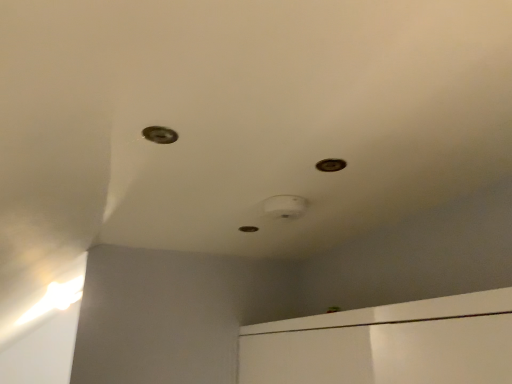
Find the location of a particular element. metallic hole at center, which appears as the third hole when viewed from the top is located at coordinates (248, 229).

Measure the distance between point [248,231] and camera.

The distance of point [248,231] from camera is 1.75 meters.

The image size is (512, 384). What do you see at coordinates (331, 165) in the screenshot?
I see `metallic circular hole at upper center, which appears as the 2th hole when viewed from the top` at bounding box center [331, 165].

I want to click on metallic hole at center, which appears as the second hole when viewed from the left, so click(248, 229).

From the image's perspective, is metallic circular hole at upper center, the second hole in the front-to-back sequence, below metallic circular hole at upper left, the 3th hole in the back-to-front sequence?

Yes, from the image's perspective, metallic circular hole at upper center, the second hole in the front-to-back sequence, is beneath metallic circular hole at upper left, the 3th hole in the back-to-front sequence.

Is metallic circular hole at upper center, the second hole in the front-to-back sequence, situated inside metallic circular hole at upper left, placed as the 1th hole when sorted from left to right, or outside?

metallic circular hole at upper center, the second hole in the front-to-back sequence, is located beyond the bounds of metallic circular hole at upper left, placed as the 1th hole when sorted from left to right.

Locate an element on the screen. The image size is (512, 384). hole that is the 1st object located behind the metallic circular hole at upper left, which ranks as the 1th hole in front-to-back order is located at coordinates (331, 165).

Considering the positions of objects metallic circular hole at upper center, which is the 3th hole in left-to-right order, and metallic circular hole at upper left, arranged as the third hole when viewed from the right, in the image provided, who is more to the right, metallic circular hole at upper center, which is the 3th hole in left-to-right order, or metallic circular hole at upper left, arranged as the third hole when viewed from the right,?

metallic circular hole at upper center, which is the 3th hole in left-to-right order.

From the image's perspective, which is above, metallic circular hole at upper center, the 1th hole in the right-to-left sequence, or metallic hole at center, the second hole when ordered from right to left?

metallic circular hole at upper center, the 1th hole in the right-to-left sequence, from the image's perspective.

Which point is more distant from viewer, (322, 160) or (251, 226)?

The point (251, 226) is farther from the camera.

Considering the relative positions of metallic circular hole at upper center, arranged as the 2th hole when viewed from the back, and metallic hole at center, which appears as the third hole when viewed from the top, in the image provided, is metallic circular hole at upper center, arranged as the 2th hole when viewed from the back, to the left or to the right of metallic hole at center, which appears as the third hole when viewed from the top,?

From the image, it's evident that metallic circular hole at upper center, arranged as the 2th hole when viewed from the back, is to the right of metallic hole at center, which appears as the third hole when viewed from the top.

Is metallic hole at center, which appears as the second hole when viewed from the left, at the back of metallic circular hole at upper center, which appears as the 2th hole when viewed from the top?

That's not correct — metallic circular hole at upper center, which appears as the 2th hole when viewed from the top, is not looking away from metallic hole at center, which appears as the second hole when viewed from the left.

Is metallic circular hole at upper left, the 3th hole in the bottom-to-top sequence, not close to metallic hole at center, which appears as the third hole when viewed from the front?

They are positioned close to each other.

Identify the location of hole that is the 2nd object above the metallic circular hole at upper left, arranged as the first hole when viewed from the top (from a real-world perspective). (248, 229).

Considering the sizes of objects metallic circular hole at upper left, arranged as the first hole when viewed from the top, and metallic hole at center, which appears as the second hole when viewed from the left, in the image provided, who is bigger, metallic circular hole at upper left, arranged as the first hole when viewed from the top, or metallic hole at center, which appears as the second hole when viewed from the left,?

Bigger between the two is metallic hole at center, which appears as the second hole when viewed from the left.

Based on the photo, from a real-world perspective, who is located higher, metallic circular hole at upper left, arranged as the first hole when viewed from the top, or metallic hole at center, the second hole when ordered from right to left?

In real-world perspective, metallic hole at center, the second hole when ordered from right to left, is above.

From the image's perspective, between metallic hole at center, which is the first hole in back-to-front order, and metallic circular hole at upper center, the second hole in the front-to-back sequence, which one is located above?

From the image's view, metallic circular hole at upper center, the second hole in the front-to-back sequence, is above.

Based on their sizes in the image, would you say metallic hole at center, which appears as the third hole when viewed from the top, is bigger or smaller than metallic circular hole at upper center, which is the 3th hole in left-to-right order?

In the image, metallic hole at center, which appears as the third hole when viewed from the top, appears to be larger than metallic circular hole at upper center, which is the 3th hole in left-to-right order.

What's the angular difference between metallic hole at center, the second hole when ordered from right to left, and metallic circular hole at upper center, the 1th hole in the right-to-left sequence,'s facing directions?

There is a 2.33-degree angle between the facing directions of metallic hole at center, the second hole when ordered from right to left, and metallic circular hole at upper center, the 1th hole in the right-to-left sequence.

In the scene shown: From a real-world perspective, who is located lower, metallic hole at center, which appears as the second hole when viewed from the left, or metallic circular hole at upper center, which is the 3th hole in left-to-right order?

metallic circular hole at upper center, which is the 3th hole in left-to-right order.

Does metallic circular hole at upper left, placed as the 1th hole when sorted from left to right, touch metallic circular hole at upper center, the 1th hole in the right-to-left sequence?

No, metallic circular hole at upper left, placed as the 1th hole when sorted from left to right, is not with metallic circular hole at upper center, the 1th hole in the right-to-left sequence.

Could you tell me if metallic circular hole at upper left, the 3th hole in the bottom-to-top sequence, is facing metallic circular hole at upper center, which is the second hole from bottom to top?

No, metallic circular hole at upper left, the 3th hole in the bottom-to-top sequence, is not facing towards metallic circular hole at upper center, which is the second hole from bottom to top.

Relative to metallic circular hole at upper center, which is the 3th hole in left-to-right order, is metallic circular hole at upper left, arranged as the third hole when viewed from the right, in front or behind?

metallic circular hole at upper left, arranged as the third hole when viewed from the right, is positioned closer to the viewer than metallic circular hole at upper center, which is the 3th hole in left-to-right order.

From a real-world perspective, which is physically below, metallic circular hole at upper left, the 3th hole in the back-to-front sequence, or metallic circular hole at upper center, which is the 3th hole in left-to-right order?

metallic circular hole at upper left, the 3th hole in the back-to-front sequence, from a real-world perspective.

Between point (252, 226) and point (159, 135), which one is positioned behind?

The point (252, 226) is more distant.

Does metallic hole at center, which appears as the third hole when viewed from the top, turn towards metallic circular hole at upper left, placed as the 1th hole when sorted from left to right?

No, metallic hole at center, which appears as the third hole when viewed from the top, does not turn towards metallic circular hole at upper left, placed as the 1th hole when sorted from left to right.

How far apart are metallic hole at center, which appears as the second hole when viewed from the left, and metallic circular hole at upper left, arranged as the first hole when viewed from the top?

The distance of metallic hole at center, which appears as the second hole when viewed from the left, from metallic circular hole at upper left, arranged as the first hole when viewed from the top, is 30.78 inches.

Which of these two, metallic hole at center, which appears as the second hole when viewed from the left, or metallic circular hole at upper left, which ranks as the 1th hole in front-to-back order, is wider?

metallic hole at center, which appears as the second hole when viewed from the left, is wider.

The width and height of the screenshot is (512, 384). In order to click on the 2nd hole counting from the right of the metallic circular hole at upper left, placed as the 1th hole when sorted from left to right in this screenshot , I will do `click(331, 165)`.

Identify the location of hole lying behind the metallic circular hole at upper center, which is the 3th hole in left-to-right order. The height and width of the screenshot is (384, 512). (248, 229).

Based on their spatial positions, is metallic circular hole at upper center, which appears as the 2th hole when viewed from the top, or metallic circular hole at upper left, the 3th hole in the bottom-to-top sequence, closer to metallic hole at center, which appears as the second hole when viewed from the left?

Based on the image, metallic circular hole at upper center, which appears as the 2th hole when viewed from the top, appears to be nearer to metallic hole at center, which appears as the second hole when viewed from the left.

From the image, which object appears to be nearer to metallic circular hole at upper center, the second hole in the front-to-back sequence, metallic hole at center, which appears as the second hole when viewed from the left, or metallic circular hole at upper left, the 3th hole in the bottom-to-top sequence?

Based on the image, metallic circular hole at upper left, the 3th hole in the bottom-to-top sequence, appears to be nearer to metallic circular hole at upper center, the second hole in the front-to-back sequence.

From the image, which object appears to be nearer to metallic hole at center, which appears as the third hole when viewed from the front, metallic circular hole at upper left, the 3th hole in the back-to-front sequence, or metallic circular hole at upper center, the second hole in the front-to-back sequence?

metallic circular hole at upper center, the second hole in the front-to-back sequence, is closer to metallic hole at center, which appears as the third hole when viewed from the front.

From the image, which object appears to be farther from metallic circular hole at upper left, arranged as the first hole when viewed from the top, metallic circular hole at upper center, which is the 3th hole in left-to-right order, or metallic hole at center, which is the first hole from bottom to top?

The object further to metallic circular hole at upper left, arranged as the first hole when viewed from the top, is metallic hole at center, which is the first hole from bottom to top.

From the picture: Based on their spatial positions, is metallic circular hole at upper left, the 3th hole in the back-to-front sequence, or metallic hole at center, which appears as the third hole when viewed from the top, closer to metallic circular hole at upper center, which appears as the 2th hole when viewed from the top?

metallic circular hole at upper left, the 3th hole in the back-to-front sequence, is closer to metallic circular hole at upper center, which appears as the 2th hole when viewed from the top.

Which object lies further to the anchor point metallic circular hole at upper left, arranged as the first hole when viewed from the top, metallic hole at center, which appears as the third hole when viewed from the top, or metallic circular hole at upper center, which appears as the 2th hole when viewed from the top?

metallic hole at center, which appears as the third hole when viewed from the top, is positioned further to the anchor metallic circular hole at upper left, arranged as the first hole when viewed from the top.

Image resolution: width=512 pixels, height=384 pixels. I want to click on hole between metallic circular hole at upper left, arranged as the first hole when viewed from the top, and metallic hole at center, which appears as the third hole when viewed from the front, along the z-axis, so click(x=331, y=165).